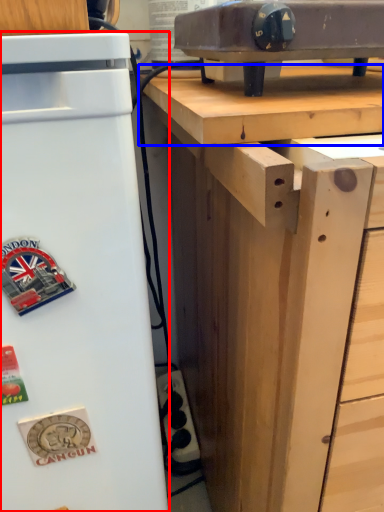
Question: Which object appears closest to the camera in this image, refrigerator (highlighted by a red box) or wood (highlighted by a blue box)?

Choices:
 (A) refrigerator
 (B) wood

Answer: (A)